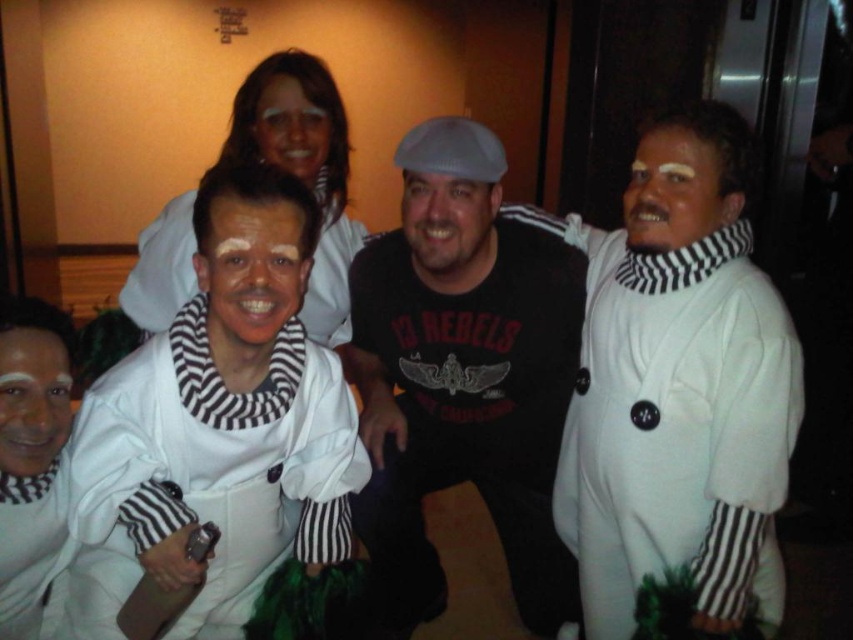
You are a photographer at a themed party. You want to take a photo of the black matte shirt at center and the white matte robe at right. The camera you are using has a minimum focus distance of 10 inches. Will you be able to focus on both subjects clearly?

The black matte shirt at center and white matte robe at right are 11.12 inches apart from each other. Since the minimum focus distance is 10 inches, the camera can focus on both subjects clearly as the distance between them is within the required range.

You are organizing a costume party and need to arrange the outfits on a display rack. The white matte jumpsuit at center and the black matte shirt at center must be placed side by side. Which one requires a narrower space on the rack?

The white matte jumpsuit at center has a lesser width compared to the black matte shirt at center, so it requires a narrower space on the rack.

You are organizing a costume party and need to arrange the costumes from shortest to tallest. Given the white matte jumpsuit at center and the white matte robe at right, which one should come first in the arrangement?

The white matte jumpsuit at center should come first in the arrangement since it has a lesser height compared to the white matte robe at right.